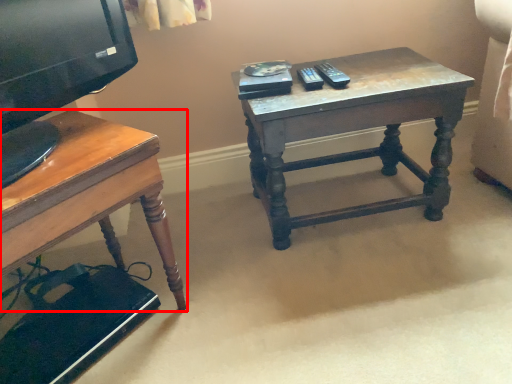
Question: From the image's perspective, considering the relative positions of desk (annotated by the red box) and table in the image provided, where is desk (annotated by the red box) located with respect to the staircase?

Choices:
 (A) above
 (B) below

Answer: (B)